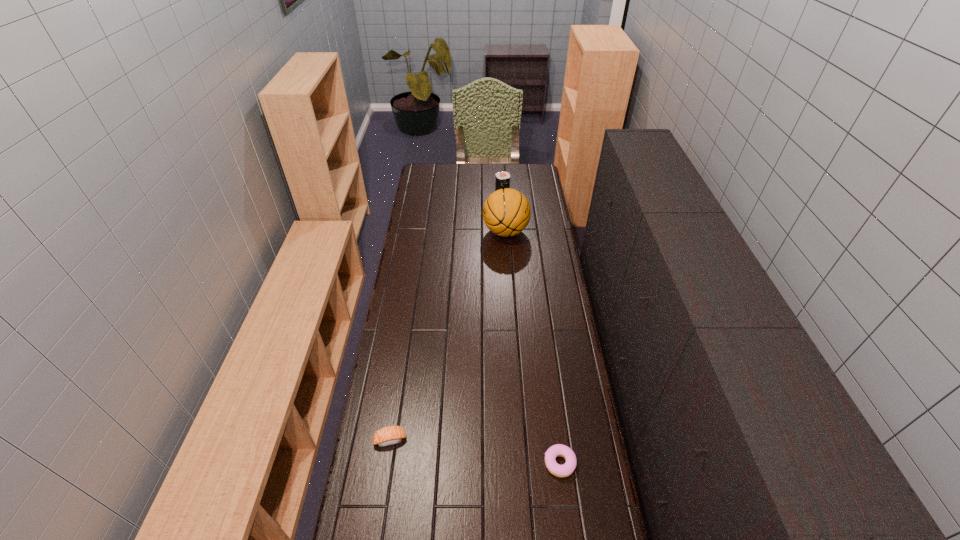
In the image, there is a desktop. Find the location of `vacant space at the right edge`. vacant space at the right edge is located at coordinates (543, 420).

The height and width of the screenshot is (540, 960). In the image, there is a desktop. What are the coordinates of `vacant space at the far left corner` in the screenshot? It's located at (423, 172).

The image size is (960, 540). In order to click on vacant area that lies between the third tallest object and the doughnut in this screenshot , I will do `click(475, 451)`.

Identify the location of empty space that is in between the farther sushi and the second shortest object. click(446, 313).

What are the coordinates of `vacant area between the right sushi and the doughnut` in the screenshot? It's located at (531, 325).

Where is `vacant space that's between the nearest object and the farther sushi`? vacant space that's between the nearest object and the farther sushi is located at coordinates (531, 325).

Identify the location of free space between the doughnut and the taller sushi. (531, 325).

Locate an element on the screen. Image resolution: width=960 pixels, height=540 pixels. empty location between the nearer sushi and the farther sushi is located at coordinates (446, 313).

Where is `free point between the shorter sushi and the tallest object`? free point between the shorter sushi and the tallest object is located at coordinates (448, 335).

Identify the location of unoccupied position between the basketball and the nearest object. coord(533,348).